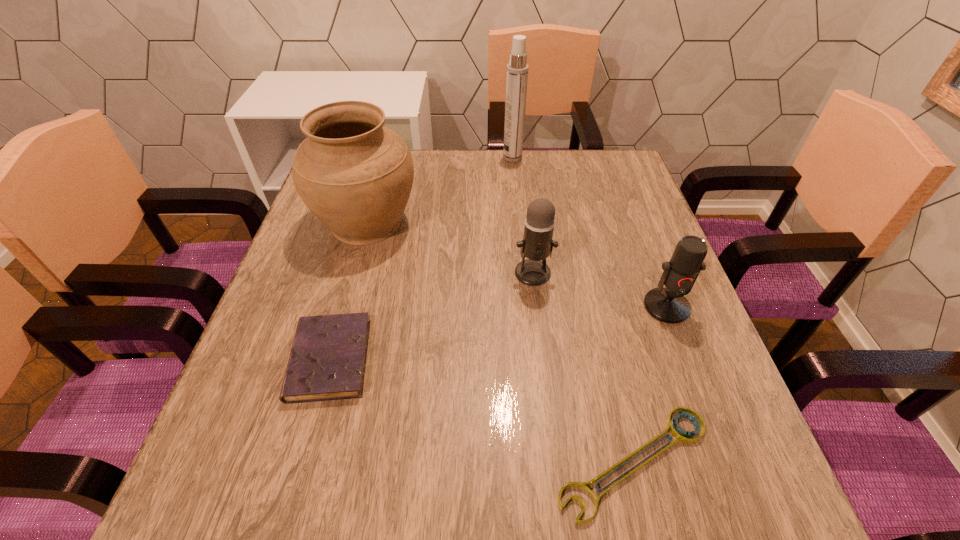
Where is `the shortest object`? the shortest object is located at coordinates [682, 436].

This screenshot has height=540, width=960. I want to click on vacant space located 0.270m on the right of the tallest object, so click(x=612, y=158).

The image size is (960, 540). Find the location of `free space located 0.170m on the right of the second farthest object`. free space located 0.170m on the right of the second farthest object is located at coordinates pyautogui.click(x=487, y=222).

At what (x,y) coordinates should I click in order to perform the action: click on free region located 0.130m on the front of the farther microphone. Please return your answer as a coordinate pair (x, y). This screenshot has width=960, height=540. Looking at the image, I should click on (540, 334).

Identify the location of vacant space located 0.070m on the side of the nearer microphone with the red ring. Image resolution: width=960 pixels, height=540 pixels. (684, 353).

Find the location of a particular element. The width and height of the screenshot is (960, 540). free space located 0.310m on the right of the diary is located at coordinates (535, 359).

Identify the location of vacant area situated 0.260m on the back of the shortest object. This screenshot has width=960, height=540. (594, 297).

Image resolution: width=960 pixels, height=540 pixels. In order to click on aerosol can at the far edge in this screenshot , I will do `click(517, 70)`.

At what (x,y) coordinates should I click in order to perform the action: click on urn located in the far edge section of the desktop. Please return your answer as a coordinate pair (x, y). Looking at the image, I should click on (355, 175).

Locate an element on the screen. This screenshot has width=960, height=540. object that is at the near edge is located at coordinates (682, 436).